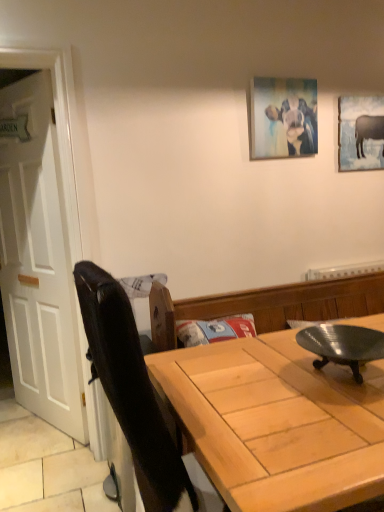
Where is `free spot below metallic silver plate at center (from a real-world perspective)`? free spot below metallic silver plate at center (from a real-world perspective) is located at coordinates (339, 376).